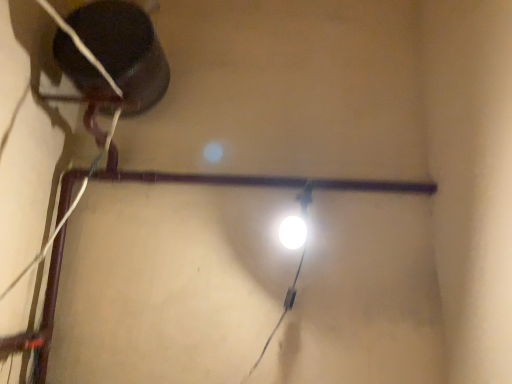
Where is `brown matte pipe at center`? brown matte pipe at center is located at coordinates (268, 181).

What do you see at coordinates (268, 181) in the screenshot? I see `brown matte pipe at center` at bounding box center [268, 181].

Identify the location of brown matte pipe at center. (268, 181).